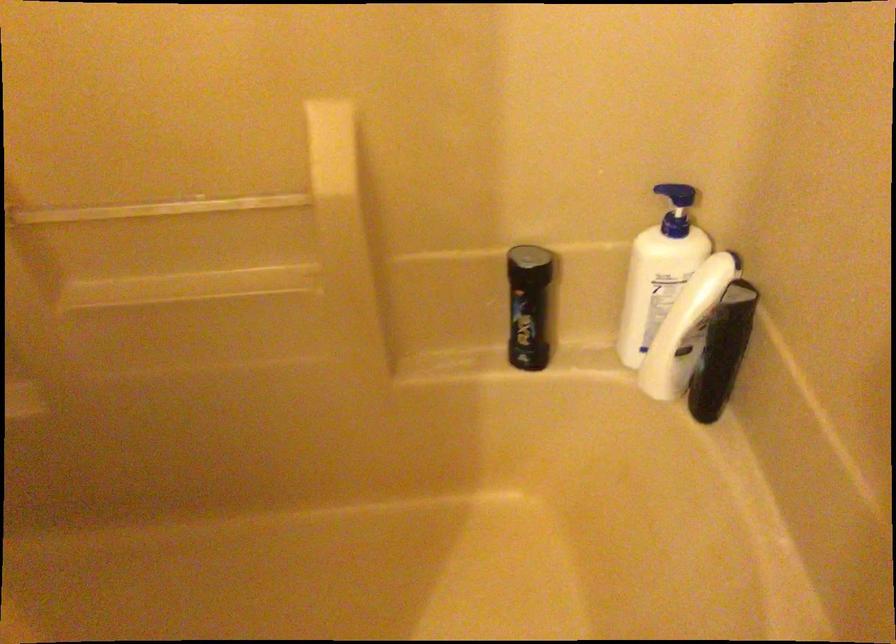
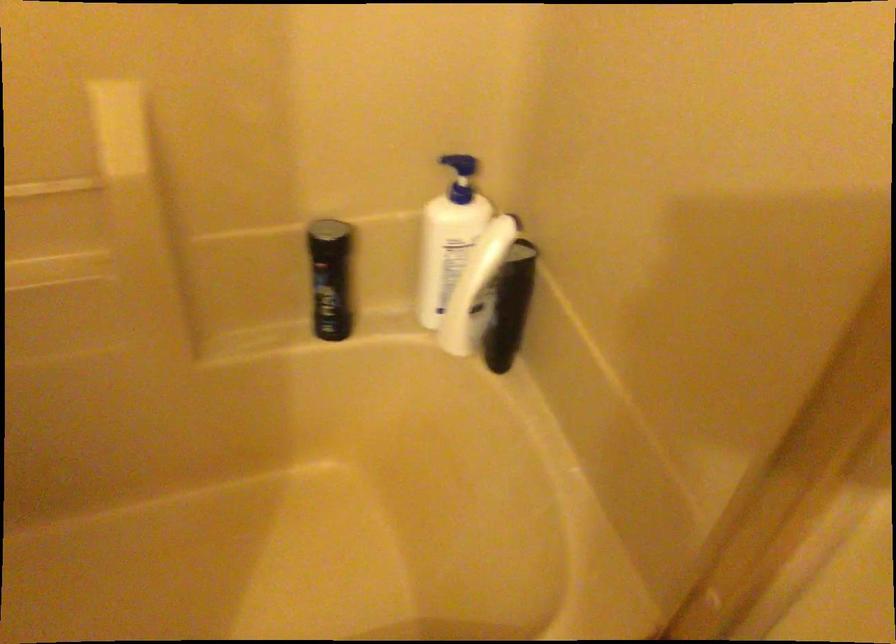
In the second image, find the point that corresponds to the point at 528,306 in the first image.

(330, 278)